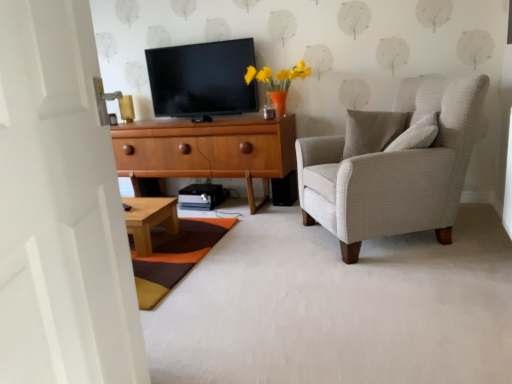
Find the location of a particular element. The width and height of the screenshot is (512, 384). vacant area in front of light gray fabric armchair at right is located at coordinates (406, 291).